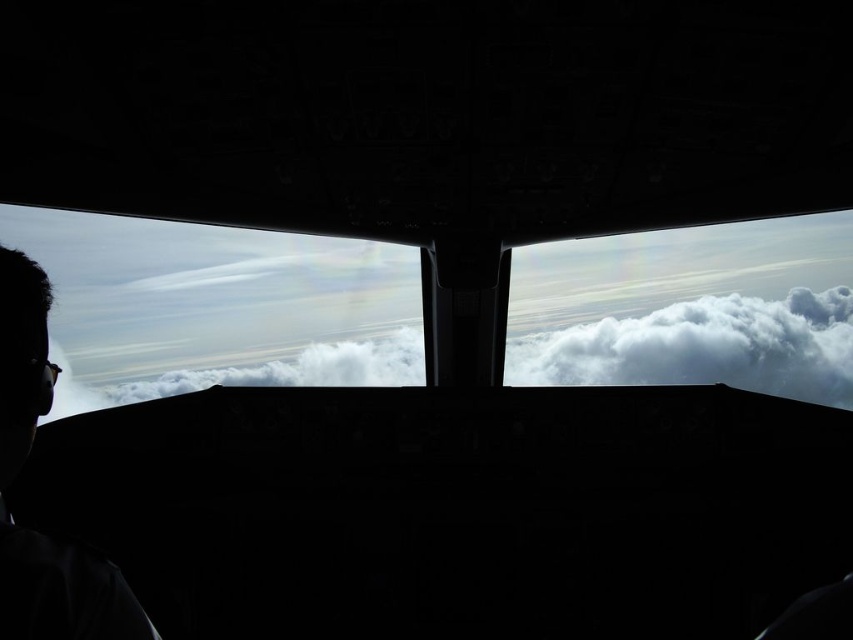
Describe the element at coordinates (216, 307) in the screenshot. I see `transparent glass airplane window at center` at that location.

Who is taller, transparent glass airplane window at center or white fluffy cloud at center?

transparent glass airplane window at center

Locate an element on the screen. Image resolution: width=853 pixels, height=640 pixels. transparent glass airplane window at center is located at coordinates (216, 307).

Who is positioned more to the left, transparent glass airplane window at center or silhouette head at left?

silhouette head at left is more to the left.

Between transparent glass airplane window at center and silhouette head at left, which one has less height?

Standing shorter between the two is silhouette head at left.

Describe the element at coordinates (216, 307) in the screenshot. I see `transparent glass airplane window at center` at that location.

You are a GUI agent. You are given a task and a screenshot of the screen. Output one action in this format:
    pyautogui.click(x=<x>, y=<y>)
    Task: Click on the transparent glass airplane window at center
    The image size is (853, 640).
    Given the screenshot: What is the action you would take?
    pyautogui.click(x=216, y=307)

Can you confirm if white fluffy cloud at center is positioned above silhouette head at left?

Incorrect, white fluffy cloud at center is not positioned above silhouette head at left.

Between white fluffy cloud at center and silhouette head at left, which one is positioned higher?

silhouette head at left

Find the location of a particular element. The image size is (853, 640). white fluffy cloud at center is located at coordinates (704, 346).